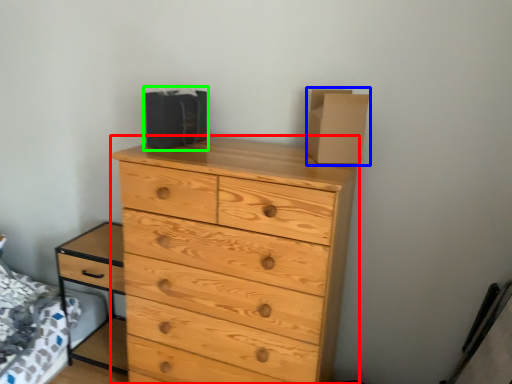
Question: Estimate the real-world distances between objects in this image. Which object is farther from chest of drawers (highlighted by a red box), cardboard box (highlighted by a blue box) or cardboard box (highlighted by a green box)?

Choices:
 (A) cardboard box
 (B) cardboard box

Answer: (B)